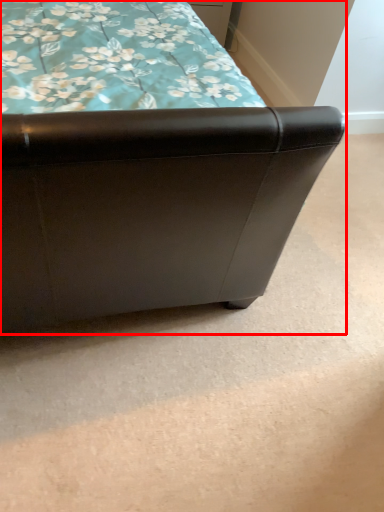
Question: In this image, where is furniture (annotated by the red box) located relative to drawer?

Choices:
 (A) right
 (B) left

Answer: (B)